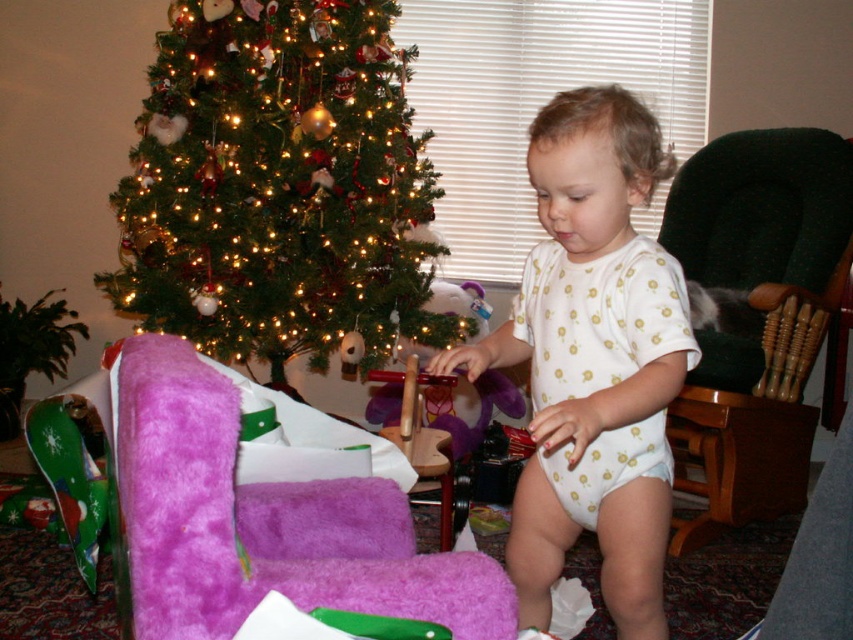
You are standing in the living room and want to place a small gift near the two points marked in the image. Which point, point (233,282) or point (50,333), is closer to you where you can easily reach it without moving?

Point (233,282) is closer to the viewer than point (50,333), so you can easily reach it without moving.

You are a parent trying to place a new toy on the highest point between the green fabric armchair at right and the white dotted diaper at center. Which object should you choose?

The green fabric armchair at right is taller than the white dotted diaper at center, so you should choose the green fabric armchair at right as the highest point.